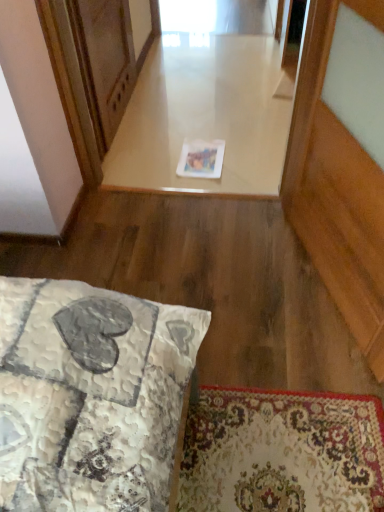
What do you see at coordinates (105, 60) in the screenshot?
I see `wooden screen door at upper left` at bounding box center [105, 60].

What are the coordinates of `wooden screen door at upper left` in the screenshot? It's located at (105, 60).

Locate an element on the screen. white glossy paper at center is located at coordinates (208, 103).

Image resolution: width=384 pixels, height=512 pixels. Describe the element at coordinates (208, 103) in the screenshot. I see `white glossy paper at center` at that location.

The height and width of the screenshot is (512, 384). Identify the location of wooden screen door at upper left. (105, 60).

Is white glossy paper at center to the right of wooden screen door at upper left from the viewer's perspective?

Yes.

Which object is closer to the camera, white glossy paper at center or wooden screen door at upper left?

wooden screen door at upper left is closer to the camera.

Considering the positions of point (175, 103) and point (120, 87), is point (175, 103) closer or farther from the camera than point (120, 87)?

Point (175, 103).

From the image's perspective, does white glossy paper at center appear lower than wooden screen door at upper left?

Indeed, from the image's perspective, white glossy paper at center is shown beneath wooden screen door at upper left.

From a real-world perspective, is white glossy paper at center on wooden screen door at upper left?

No, from a real-world perspective, white glossy paper at center is not on top of wooden screen door at upper left.

Is white glossy paper at center wider or thinner than wooden screen door at upper left?

white glossy paper at center is wider than wooden screen door at upper left.

Between white glossy paper at center and wooden screen door at upper left, which one has more height?

With more height is wooden screen door at upper left.

Which of these two, white glossy paper at center or wooden screen door at upper left, is smaller?

wooden screen door at upper left.

Is white glossy paper at center not inside wooden screen door at upper left?

Yes.

Is the surface of white glossy paper at center in direct contact with wooden screen door at upper left?

white glossy paper at center and wooden screen door at upper left are clearly separated.

Is white glossy paper at center looking in the opposite direction of wooden screen door at upper left?

No, white glossy paper at center's orientation is not away from wooden screen door at upper left.

You are a GUI agent. You are given a task and a screenshot of the screen. Output one action in this format:
    pyautogui.click(x=<x>, y=<y>)
    Task: Click on the screen door that is above the white glossy paper at center (from the image's perspective)
    The height and width of the screenshot is (512, 384).
    Given the screenshot: What is the action you would take?
    pyautogui.click(x=105, y=60)

Which is more to the right, wooden screen door at upper left or white glossy paper at center?

From the viewer's perspective, white glossy paper at center appears more on the right side.

Is the position of wooden screen door at upper left more distant than that of white glossy paper at center?

That is False.

Which is in front, point (84, 1) or point (286, 72)?

Positioned in front is point (84, 1).

Based on the photo, from the image's perspective, is wooden screen door at upper left positioned above or below white glossy paper at center?

wooden screen door at upper left is above white glossy paper at center.

From a real-world perspective, is wooden screen door at upper left above or below white glossy paper at center?

wooden screen door at upper left is above white glossy paper at center.

Does wooden screen door at upper left have a greater width compared to white glossy paper at center?

In fact, wooden screen door at upper left might be narrower than white glossy paper at center.

Between wooden screen door at upper left and white glossy paper at center, which one has more height?

wooden screen door at upper left.

Which of these two, wooden screen door at upper left or white glossy paper at center, is bigger?

white glossy paper at center is bigger.

Does wooden screen door at upper left contain white glossy paper at center?

That's incorrect, white glossy paper at center is not inside wooden screen door at upper left.

Can you see wooden screen door at upper left touching white glossy paper at center?

wooden screen door at upper left and white glossy paper at center are clearly separated.

Is white glossy paper at center at the back of wooden screen door at upper left?

That's not correct — wooden screen door at upper left is not looking away from white glossy paper at center.

How different are the orientations of wooden screen door at upper left and white glossy paper at center in degrees?

They differ by 89.6 degrees in their facing directions.

Measure the distance from wooden screen door at upper left to white glossy paper at center.

wooden screen door at upper left and white glossy paper at center are 19.46 inches apart from each other.

Identify the location of screen door above the white glossy paper at center (from the image's perspective). (105, 60).

Identify the location of window that appears below the wooden screen door at upper left (from the image's perspective). The image size is (384, 512). (x=208, y=103).

Locate an element on the screen. This screenshot has width=384, height=512. window below the wooden screen door at upper left (from a real-world perspective) is located at coordinates (208, 103).